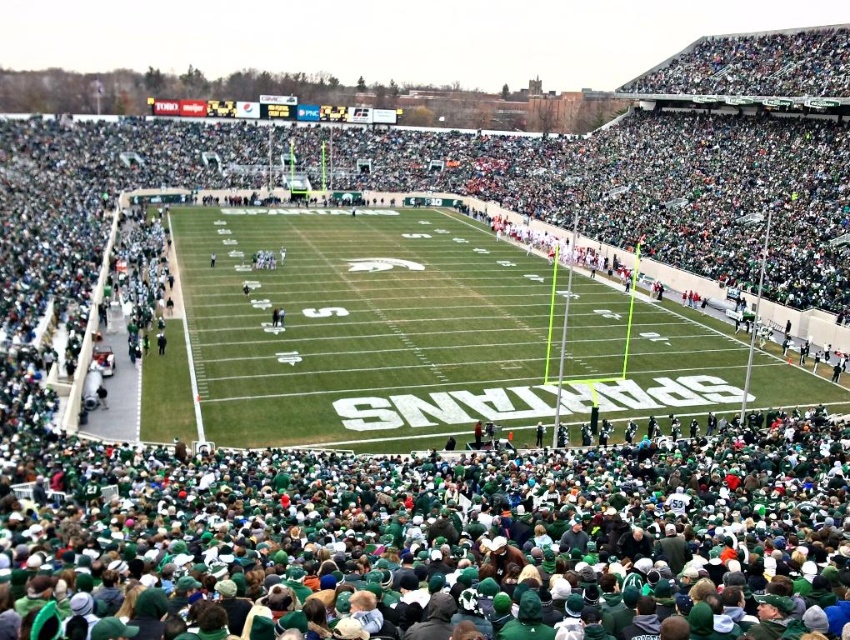
You are a drone operator trying to capture aerial footage of the game. You need to fly your drone from the green fabric crowd at lower center to the green grass football field at center. Can you fly your drone directly above the crowd to reach the field without any obstacles?

The green fabric crowd at lower center is positioned under the green grass football field at center, so flying directly above the crowd would allow the drone to reach the field without obstacles.

You are a photographer positioned at the center of the field during the game. You want to take a photo that includes both the point at coordinates point (395, 545) and point (259, 410). Which point should you focus on first to ensure both are in frame?

Point (395, 545) is in front of point (259, 410), so you should focus on point (395, 545) first to ensure both are in frame.

You are a drone operator trying to capture aerial footage of the stadium. You need to ensure that the camera can clearly see the football field without obstruction. Based on the scene, will the green fabric crowd at lower center block the view of the green grass football field at center?

The green fabric crowd at lower center has a lesser height compared to the green grass football field at center, so the crowd will not block the view of the field.